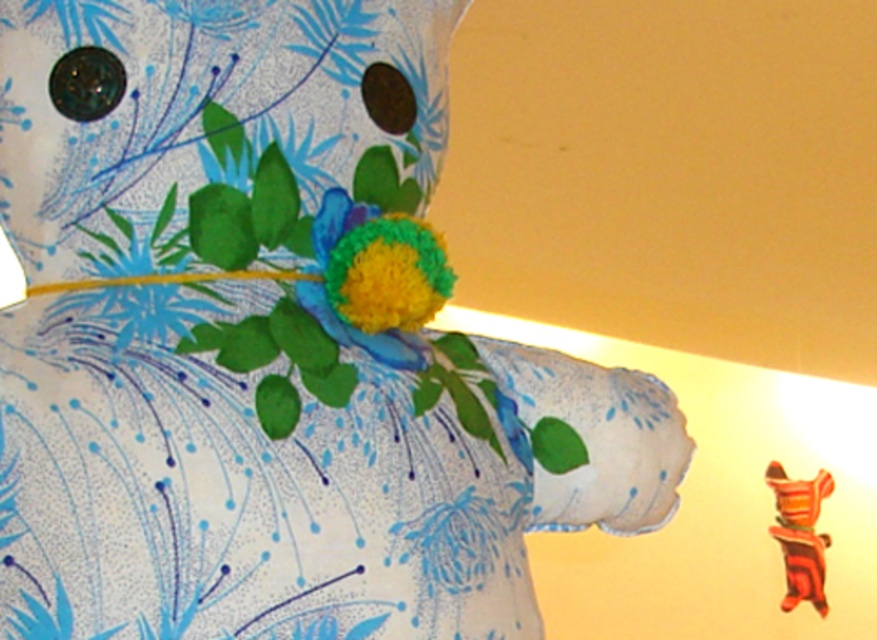
Question: Can you confirm if fluffy yellow-green flower at center is positioned to the left of striped fabric toy at center?

Choices:
 (A) yes
 (B) no

Answer: (A)

Question: Does fluffy yellow-green flower at center appear on the right side of striped fabric toy at center?

Choices:
 (A) yes
 (B) no

Answer: (B)

Question: Where is fluffy yellow-green flower at center located in relation to striped fabric toy at center in the image?

Choices:
 (A) below
 (B) above

Answer: (B)

Question: Which point is closer to the camera?

Choices:
 (A) (369, 257)
 (B) (799, 532)

Answer: (A)